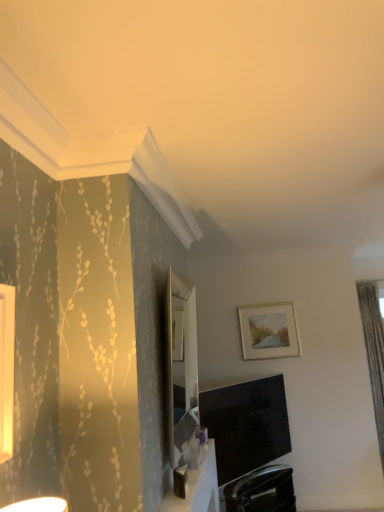
Question: Considering the positions of white glossy table at lower center and matte black tv at lower center in the image, is white glossy table at lower center taller or shorter than matte black tv at lower center?

Choices:
 (A) short
 (B) tall

Answer: (A)

Question: Is point (190, 468) positioned closer to the camera than point (243, 470)?

Choices:
 (A) farther
 (B) closer

Answer: (B)

Question: Considering the real-world distances, which object is farthest from the white glossy table at lower center?

Choices:
 (A) black leather swivel chair at lower center
 (B) gray textured curtain at right
 (C) matte white picture frame at upper right
 (D) silver metallic mirror at center
 (E) matte black tv at lower center

Answer: (B)

Question: Considering the real-world distances, which object is closest to the white glossy table at lower center?

Choices:
 (A) black leather swivel chair at lower center
 (B) matte black tv at lower center
 (C) silver metallic mirror at center
 (D) matte white picture frame at upper right
 (E) gray textured curtain at right

Answer: (C)